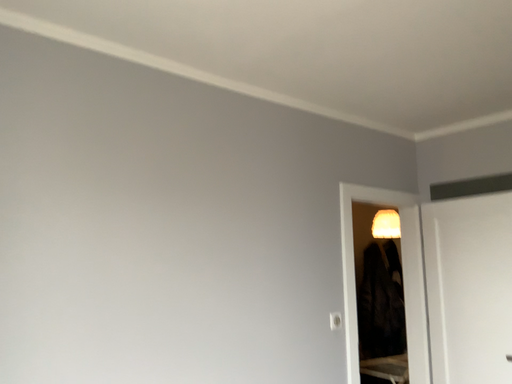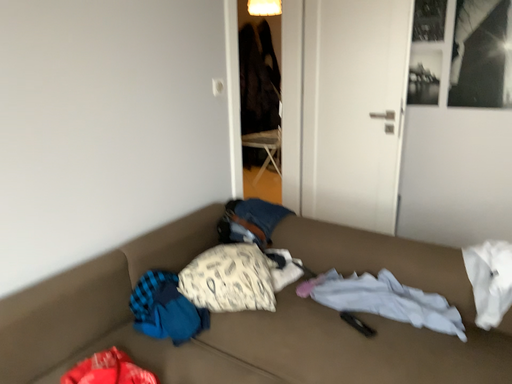
Question: Which way did the camera rotate in the video?

Choices:
 (A) rotated left
 (B) rotated right

Answer: (B)